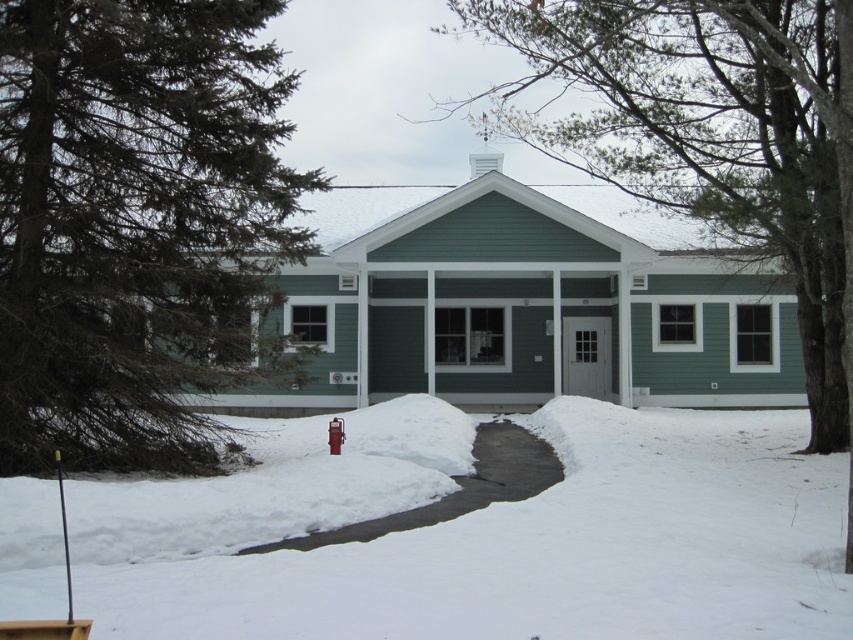
Which of these two, green wood tree at center or red metallic hydrant at center, stands shorter?

With less height is red metallic hydrant at center.

Based on the photo, measure the distance between green wood tree at center and camera.

green wood tree at center is 24.08 feet away from camera.

The height and width of the screenshot is (640, 853). Identify the location of green wood tree at center. (708, 134).

Does green textured pine tree at left lie behind red metallic hydrant at center?

No, it is not.

Can you confirm if green textured pine tree at left is positioned above red metallic hydrant at center?

Indeed, green textured pine tree at left is positioned over red metallic hydrant at center.

Is point (55, 74) in front of point (328, 445)?

Yes, point (55, 74) is closer to viewer.

Locate an element on the screen. green textured pine tree at left is located at coordinates (140, 228).

Which of these two, green textured pine tree at left or green wood tree at center, stands shorter?

green textured pine tree at left is shorter.

Is green textured pine tree at left shorter than green wood tree at center?

Yes.

Between point (210, 56) and point (746, 68), which one is positioned in front?

Positioned in front is point (210, 56).

Locate an element on the screen. The image size is (853, 640). green textured pine tree at left is located at coordinates (140, 228).